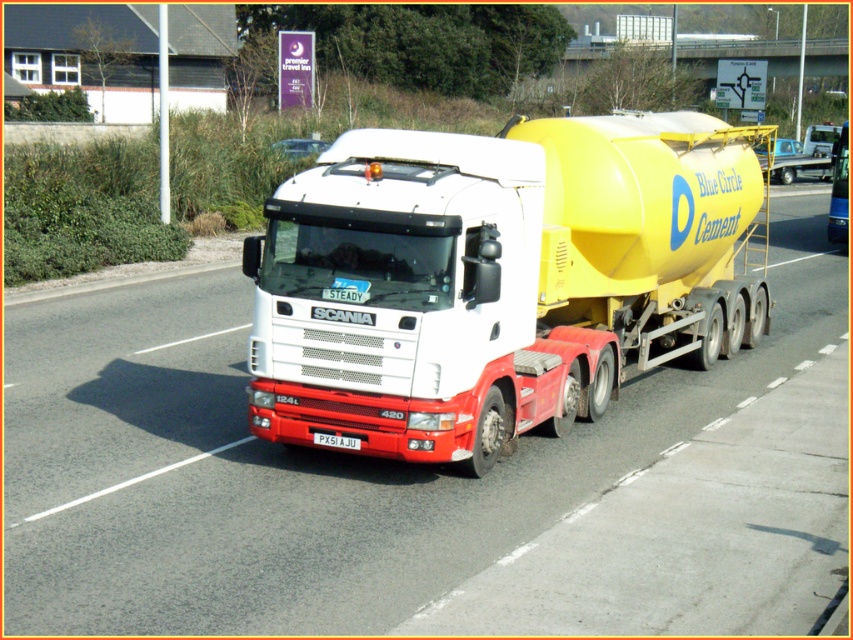
You are a traffic officer who needs to report the location of the white glossy concrete mixer truck at center. What are the coordinates of the truck?

The coordinates of the white glossy concrete mixer truck at center are at point [292,465].

You are a delivery driver who needs to maneuver a truck through a narrow tunnel. The tunnel has a height restriction of 4 meters. The yellow matte cement tank at center is attached to the white glossy concrete mixer truck at center. Considering the size difference between them, which part of the truck should you lower first to ensure safe passage through the tunnel?

The yellow matte cement tank at center is larger than the white glossy concrete mixer truck at center, so you should lower the yellow matte cement tank at center first to ensure it doesn